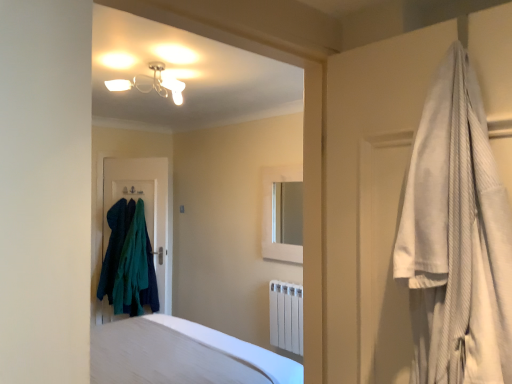
At what (x,y) coordinates should I click in order to perform the action: click on free space above white matte medicine cabinet at center (from a real-world perspective). Please return your answer as a coordinate pair (x, y). The height and width of the screenshot is (384, 512). Looking at the image, I should click on (283, 163).